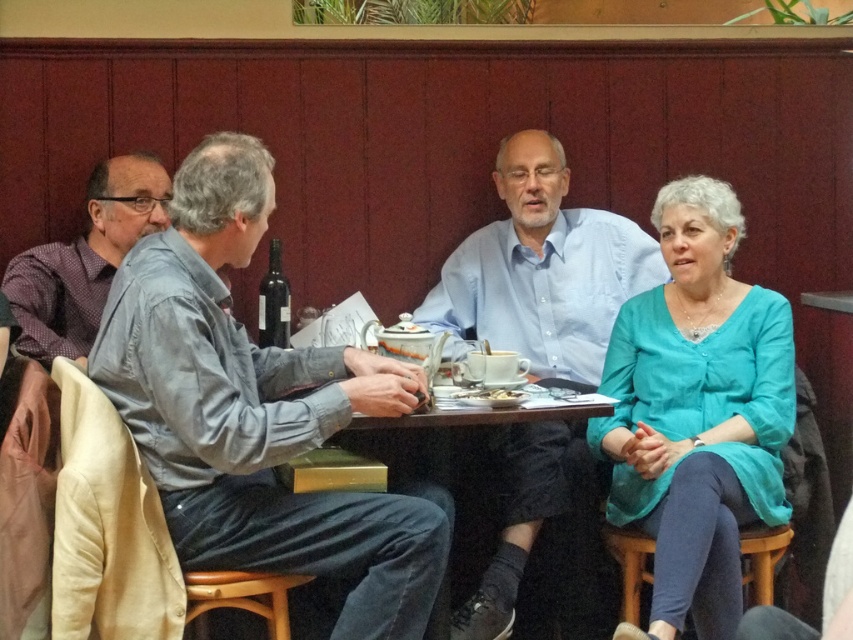
Question: Which object is closer to the camera taking this photo?

Choices:
 (A) gray cotton shirt at left
 (B) plaid shirt at left
 (C) teal fabric blouse at right
 (D) light blue shirt at center

Answer: (A)

Question: Which point is closer to the camera?

Choices:
 (A) coord(543,486)
 (B) coord(103,170)

Answer: (A)

Question: Which object appears farthest from the camera in this image?

Choices:
 (A) plaid shirt at left
 (B) light blue shirt at center
 (C) teal fabric blouse at right
 (D) dark wood table at center

Answer: (D)

Question: Can you confirm if dark wood table at center is thinner than wooden stool at lower right?

Choices:
 (A) yes
 (B) no

Answer: (B)

Question: Does teal fabric blouse at right appear under light blue shirt at center?

Choices:
 (A) yes
 (B) no

Answer: (A)

Question: Can you confirm if light blue shirt at center is wider than plaid shirt at left?

Choices:
 (A) no
 (B) yes

Answer: (B)